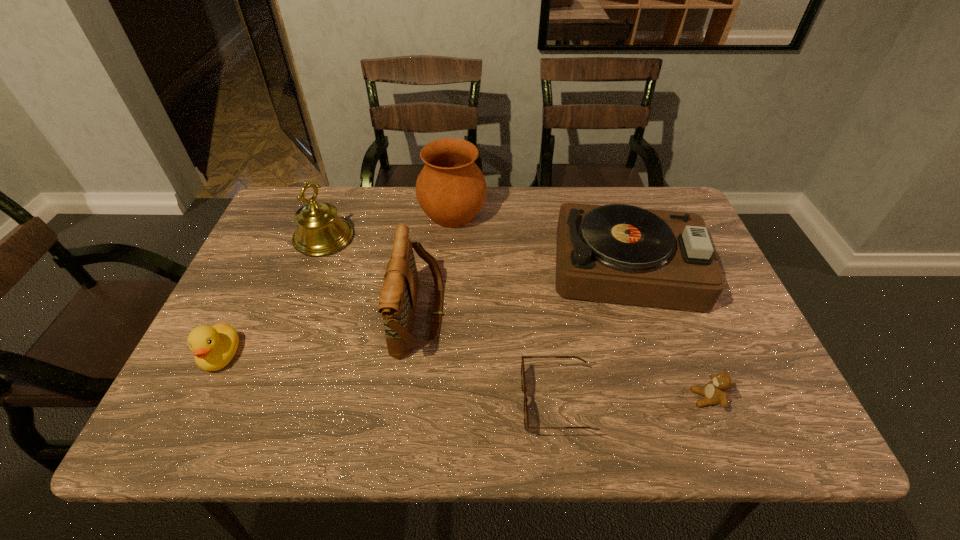
The height and width of the screenshot is (540, 960). What are the coordinates of `blank area located 0.220m on the front-facing side of the shoulder bag` in the screenshot? It's located at (535, 315).

In order to click on vacant space located 0.360m on the left of the fourth tallest object in this screenshot , I will do `click(415, 267)`.

Identify the location of vacant area located on the face of the leftmost object. Image resolution: width=960 pixels, height=540 pixels. (198, 404).

At what (x,y) coordinates should I click in order to perform the action: click on vacant space situated on the front-facing side of the second shortest object. Please return your answer as a coordinate pair (x, y). This screenshot has width=960, height=540. Looking at the image, I should click on (512, 398).

You are a GUI agent. You are given a task and a screenshot of the screen. Output one action in this format:
    pyautogui.click(x=<x>, y=<y>)
    Task: Click on the blank space located 0.360m on the front-facing side of the second shortest object
    The height and width of the screenshot is (540, 960).
    Given the screenshot: What is the action you would take?
    pyautogui.click(x=516, y=398)

This screenshot has width=960, height=540. I want to click on vacant space located on the front-facing side of the second shortest object, so click(x=506, y=398).

Where is `free location located 0.320m at the front view of the spectacles`? The height and width of the screenshot is (540, 960). free location located 0.320m at the front view of the spectacles is located at coordinates (365, 403).

Identify the location of vacant area situated at the front view of the spectacles. The image size is (960, 540). pos(483,403).

Locate an element on the screen. The width and height of the screenshot is (960, 540). vacant position located 0.250m at the front view of the spectacles is located at coordinates (399, 403).

Identify the location of pottery present at the far edge. The height and width of the screenshot is (540, 960). (451, 189).